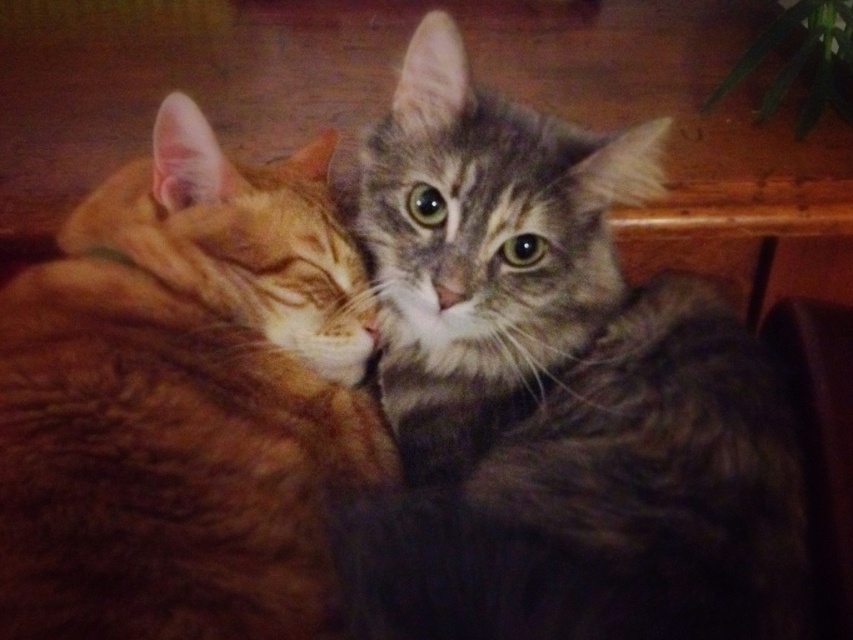
You are a photographer trying to capture both cats in a single shot. Since the orange tabby cat at left is behind the tabby fur cat at center, will you need to adjust your position to ensure both are fully visible in the frame?

Yes, you need to adjust your position because the orange tabby cat at left is behind the tabby fur cat at center, so moving slightly to the side might help capture both fully.

You are a cat owner who wants to place a small toy between the tabby fur cat at center and the orange tabby cat at left. The toy requires at least 8 inches of space to be placed safely. Can you fit the toy between them?

The tabby fur cat at center and orange tabby cat at left are 8.01 inches apart, so yes, the toy can be safely placed between them as the distance is sufficient.

Looking at this image, you are a photographer trying to capture a closeup shot of the tabby fur cat at center. Given that your camera can focus on subjects within 25 inches, will you need to move closer or farther away to get a clear shot?

The tabby fur cat at center is 26.02 inches away from the camera, which is slightly beyond the 25 inch focusing range. To get a clear shot, you need to move closer by approximately 1.02 inches.